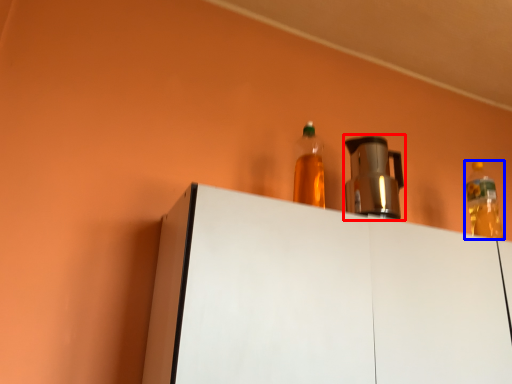
Question: Which point is further to the camera, appliance (highlighted by a red box) or bottle (highlighted by a blue box)?

Choices:
 (A) appliance
 (B) bottle

Answer: (B)